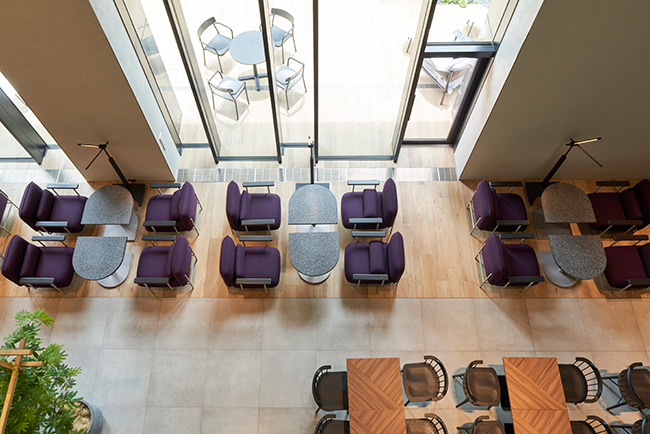
Where is `tables`? The height and width of the screenshot is (434, 650). tables is located at coordinates (240, 56), (435, 57), (320, 207), (315, 256), (112, 255), (117, 216), (582, 256), (567, 213), (543, 375), (387, 402).